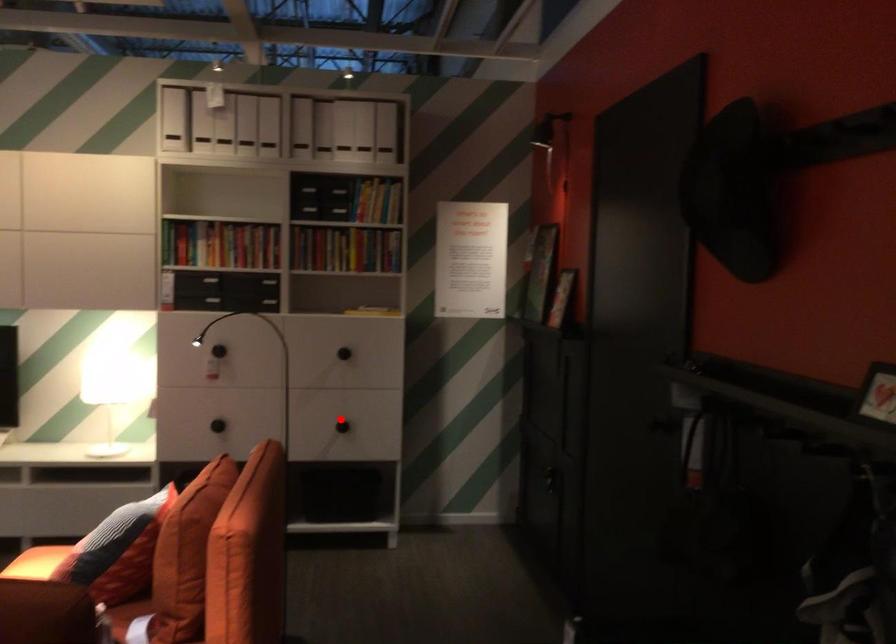
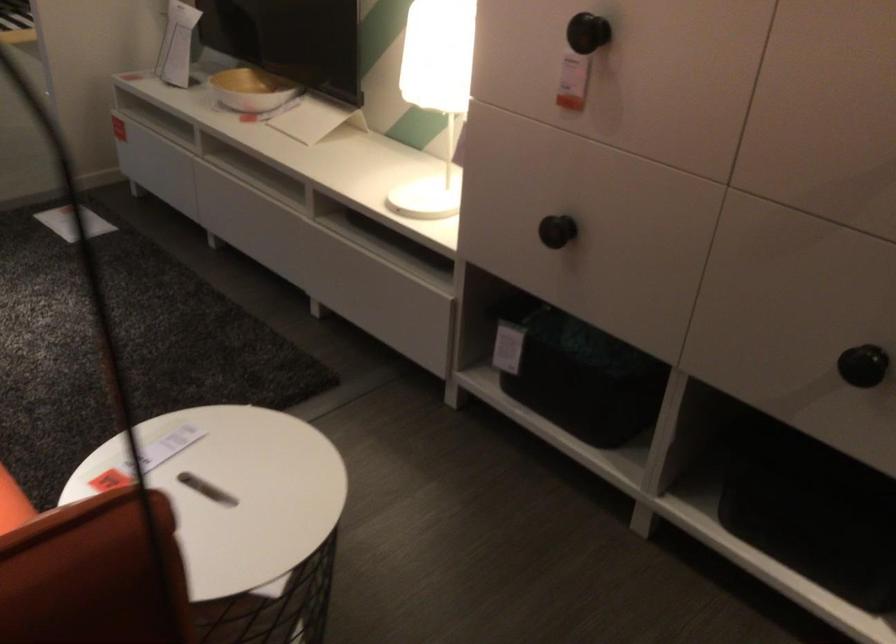
Question: I am providing you with two images of the same scene from different viewpoints. A red point is shown in image1. For the corresponding object point in image2, is it positioned nearer or farther from the camera?

Choices:
 (A) Nearer
 (B) Farther

Answer: (A)